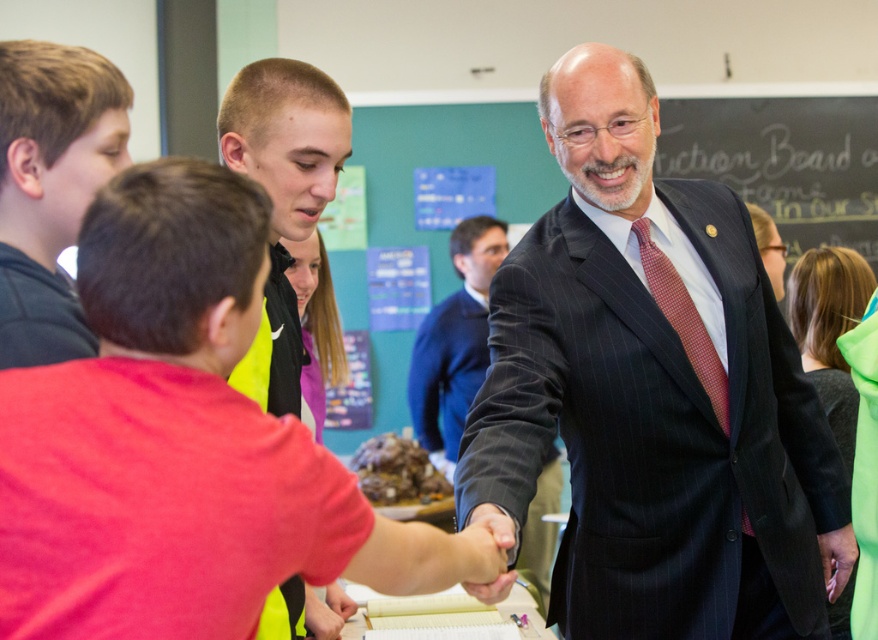
Question: Is dark brown hair at left in front of dark blue suit at center?

Choices:
 (A) yes
 (B) no

Answer: (A)

Question: Which point is farther to the camera?

Choices:
 (A) (498, 228)
 (B) (270, 195)

Answer: (A)

Question: Estimate the real-world distances between objects in this image. Which object is closer to the dark pinstripe suit at center?

Choices:
 (A) dark blue suit at center
 (B) short hair at center

Answer: (B)

Question: Which point appears closest to the camera in this image?

Choices:
 (A) (740, 307)
 (B) (318, 80)
 (C) (769, 150)
 (D) (466, 273)

Answer: (B)

Question: Does dark pinstripe suit at center appear under dark blue suit at center?

Choices:
 (A) no
 (B) yes

Answer: (B)

Question: Is short hair at center thinner than dark blue suit at center?

Choices:
 (A) yes
 (B) no

Answer: (A)